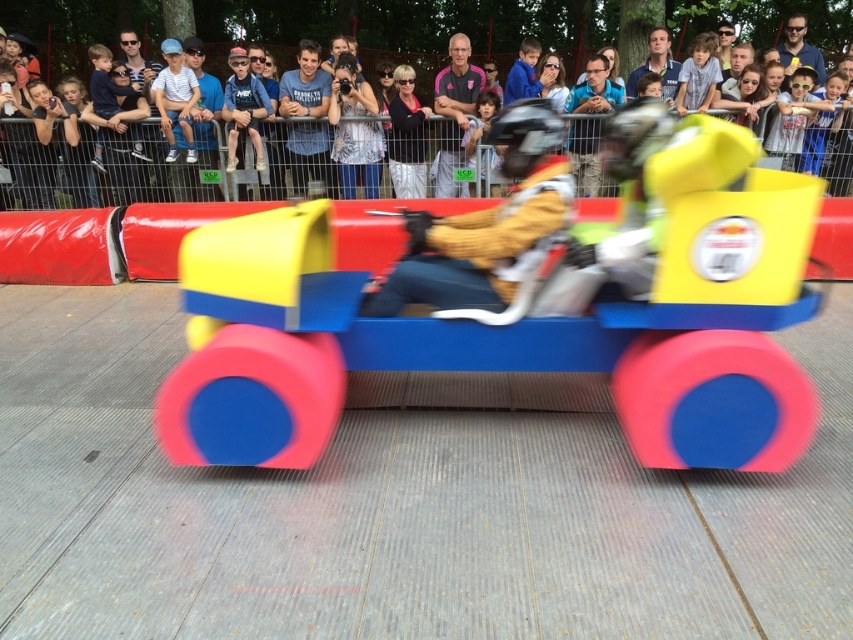
You are standing at the starting line of the race and want to take a photo of the crowd watching the race. Where should you point your camera to capture the matte plastic crowd at upper center?

You should point your camera towards the upper center area at coordinates point [422,26] to capture the matte plastic crowd at upper center.

You are a photographer at the children race event. You want to take a photo of the yellow matte helmet at center and the matte plastic crowd at upper center. Which object will appear larger in your photo?

The matte plastic crowd at upper center will appear larger in the photo because it is bigger than the yellow matte helmet at center.